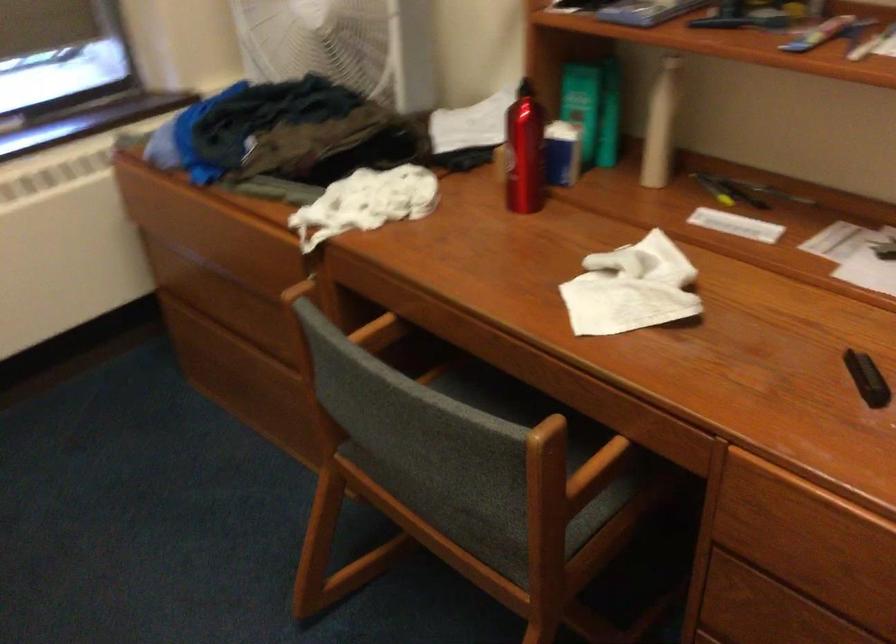
The location [524,152] corresponds to which object?

This point indicates the red water bottle.